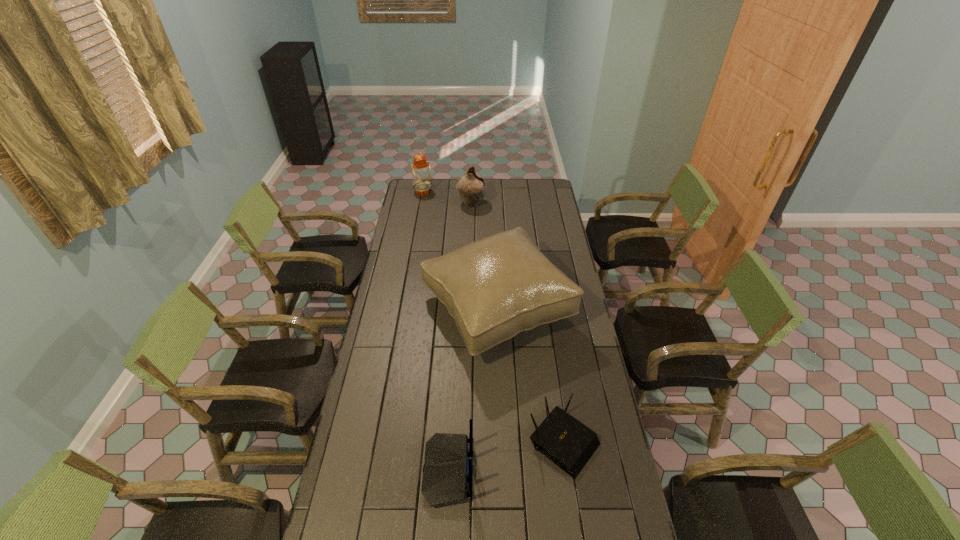
Identify the location of object that ranks as the third closest to the oil lamp. (568, 443).

This screenshot has width=960, height=540. I want to click on vacant region that satisfies the following two spatial constraints: 1. on the front side of the shorter router; 2. on the left side of the oil lamp, so pos(377,441).

The width and height of the screenshot is (960, 540). Find the location of `vacant space that satisfies the following two spatial constraints: 1. on the front side of the leftmost object; 2. on the left side of the third nearest object`. vacant space that satisfies the following two spatial constraints: 1. on the front side of the leftmost object; 2. on the left side of the third nearest object is located at coordinates (401, 311).